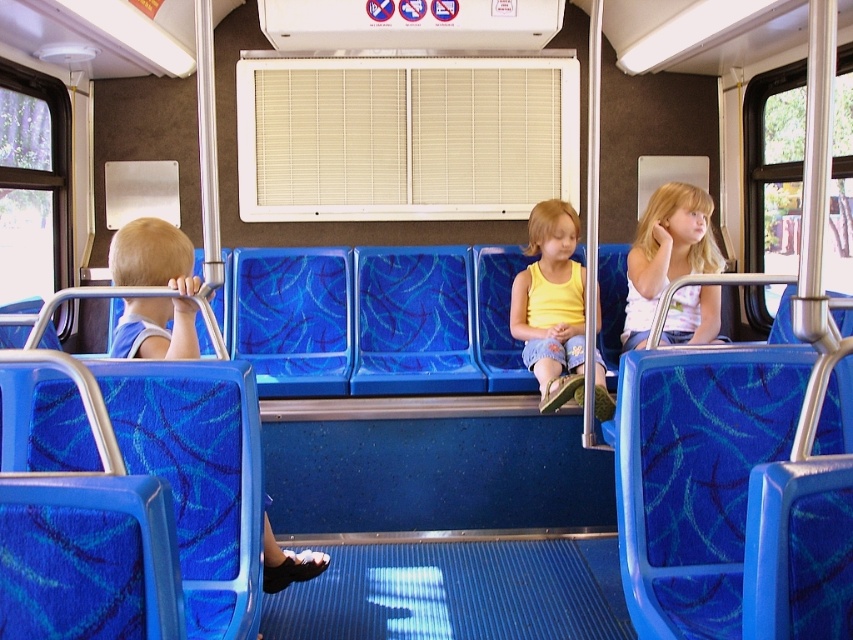
Is point (595, 412) farther from viewer compared to point (657, 272)?

No, (595, 412) is closer to viewer.

Can you confirm if yellow cotton tank top at center is positioned above light blue fabric dress at right?

No.

Is point (567, 292) farther from viewer compared to point (641, 304)?

Yes, it is behind point (641, 304).

At what (x,y) coordinates should I click in order to perform the action: click on yellow cotton tank top at center. Please return your answer as a coordinate pair (x, y). This screenshot has width=853, height=640. Looking at the image, I should click on (550, 305).

Consider the image. Between yellow cotton tank top at center and light blue fabric seat at left, which one is positioned higher?

light blue fabric seat at left is above.

Locate an element on the screen. This screenshot has height=640, width=853. yellow cotton tank top at center is located at coordinates (550, 305).

Is point (541, 406) farther from viewer compared to point (181, 282)?

Yes, point (541, 406) is farther from viewer.

This screenshot has width=853, height=640. Identify the location of yellow cotton tank top at center. (550, 305).

Is light blue fabric seat at left positioned in front of light blue fabric dress at right?

Yes, it is in front of light blue fabric dress at right.

Is light blue fabric seat at left positioned behind light blue fabric dress at right?

No, light blue fabric seat at left is closer to the viewer.

Is point (293, 572) less distant than point (637, 332)?

Yes, point (293, 572) is closer to viewer.

The height and width of the screenshot is (640, 853). Find the location of `light blue fabric seat at left`. light blue fabric seat at left is located at coordinates (152, 256).